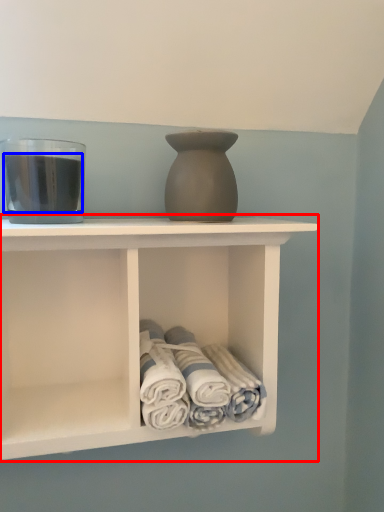
Question: Which object appears closest to the camera in this image, shelf (highlighted by a red box) or beverage (highlighted by a blue box)?

Choices:
 (A) shelf
 (B) beverage

Answer: (A)